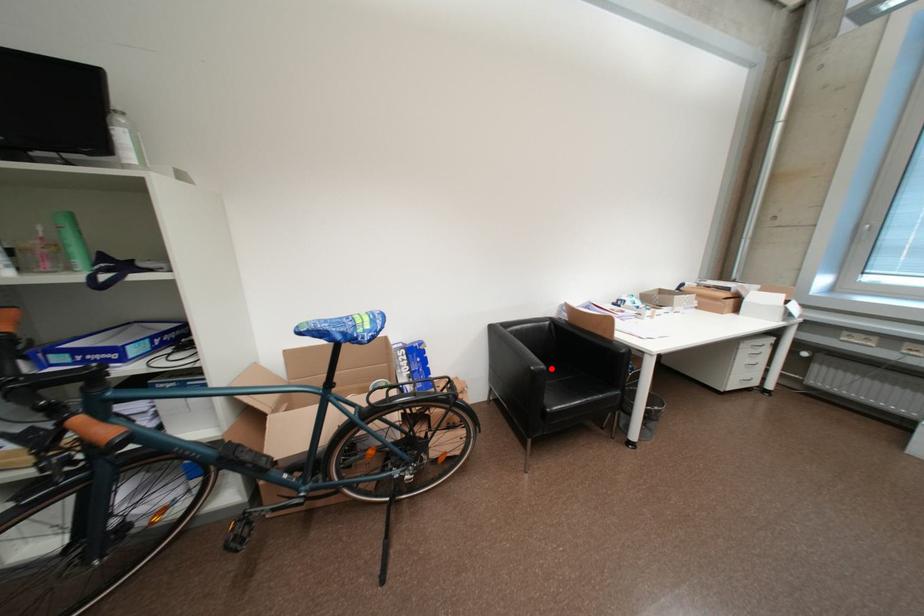
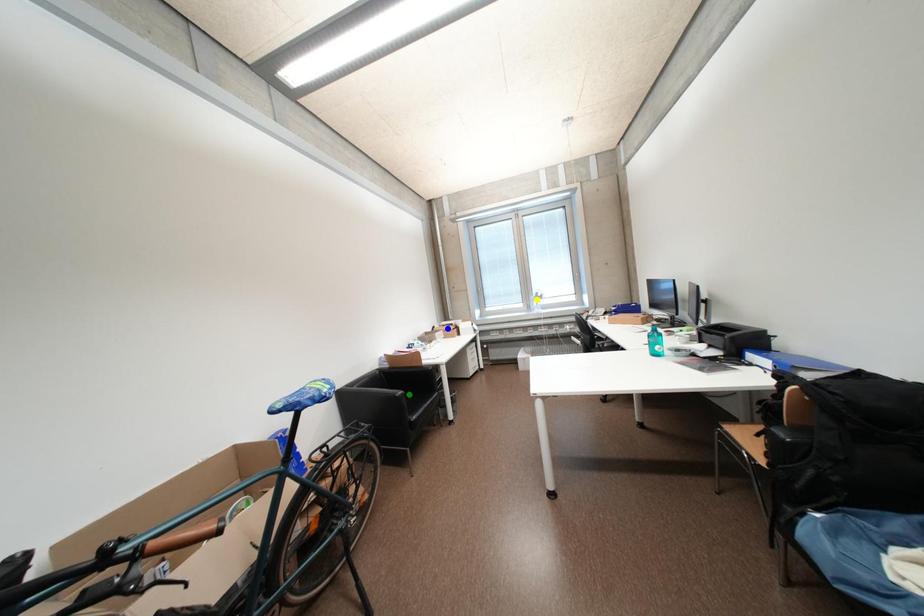
Question: I am providing you with two images of the same scene from different viewpoints. A red point is marked on the first image. You are given multiple points on the second image. Which point in image 2 represents the same 3d spot as the red point in image 1?

Choices:
 (A) yellow point
 (B) green point
 (C) blue point

Answer: (B)